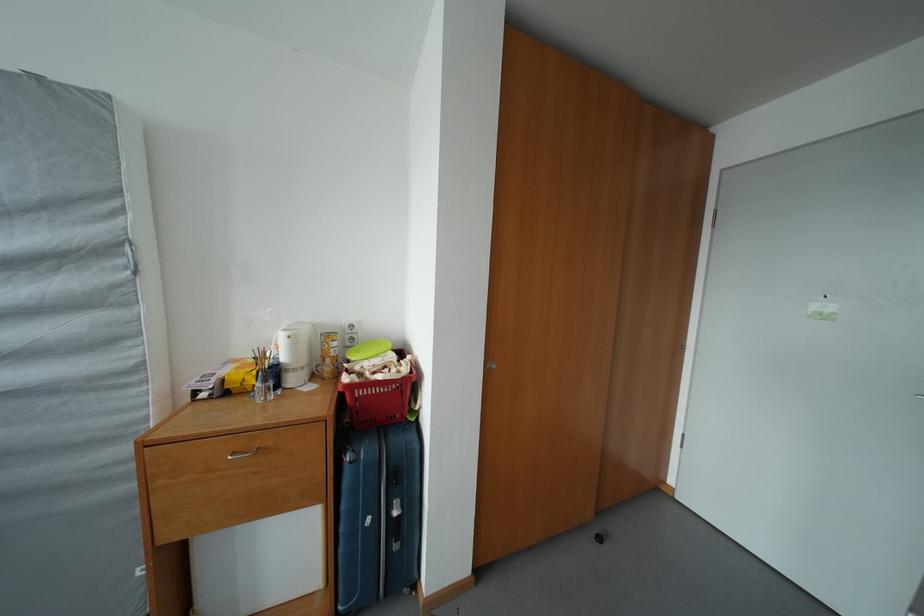
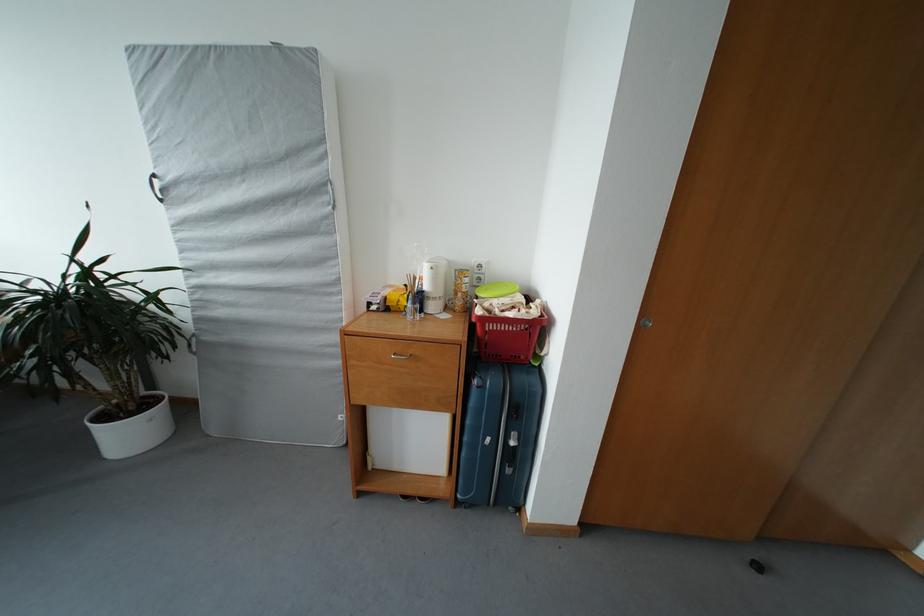
In the second image, find the point that corresponds to [402,517] in the first image.

(518, 448)